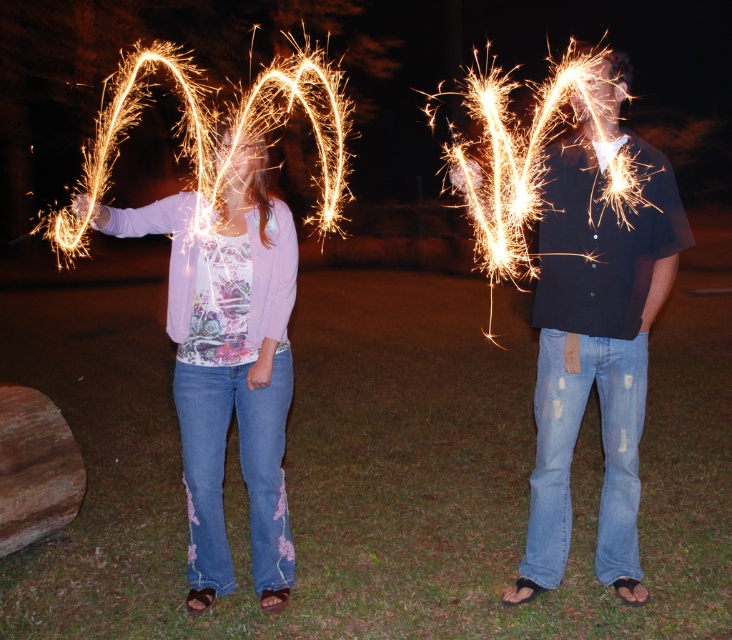
Between point (613, 72) and point (291, 256), which one is positioned in front?

Positioned in front is point (613, 72).

Which is in front, point (560, 240) or point (250, 324)?

Point (560, 240) is more forward.

Identify the location of matte black shirt at center. The width and height of the screenshot is (732, 640). (594, 323).